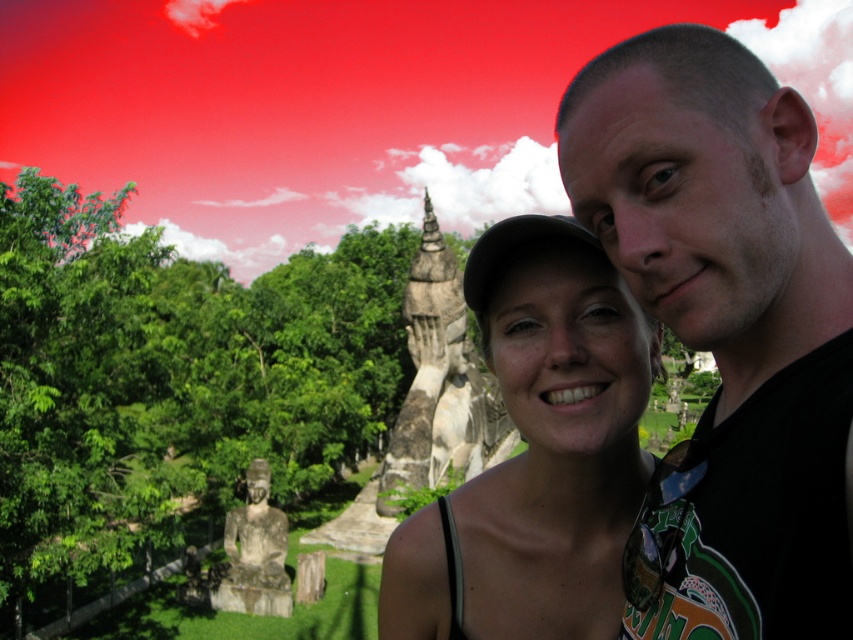
Between black matte shirt at upper right and green leafy tree at upper left, which one appears on the left side from the viewer's perspective?

Positioned to the left is green leafy tree at upper left.

Can you confirm if black matte shirt at upper right is taller than green leafy tree at upper left?

No.

Is point (796, 248) in front of point (200, 493)?

Yes, it is in front of point (200, 493).

Image resolution: width=853 pixels, height=640 pixels. I want to click on black matte shirt at upper right, so click(727, 328).

Who is more forward, (62, 412) or (616, 621)?

Point (616, 621) is in front.

Where is `green leafy tree at upper left`? The width and height of the screenshot is (853, 640). green leafy tree at upper left is located at coordinates (170, 385).

Is point (665, 221) closer to camera compared to point (421, 604)?

Yes.

Who is positioned more to the right, black matte shirt at upper right or matte gray statue at center?

black matte shirt at upper right

Who is more distant from viewer, (683, 108) or (459, 531)?

The point (459, 531) is more distant.

Identify the location of black matte shirt at upper right. (727, 328).